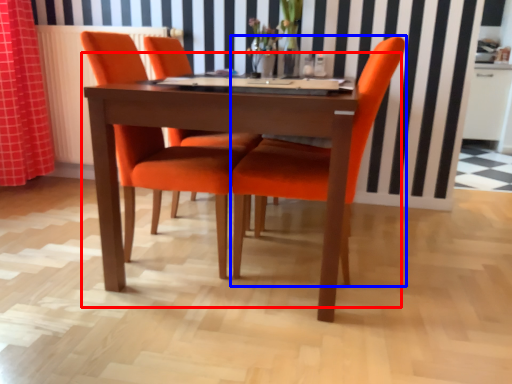
Question: Which point is further to the camera, kitchen & dining room table (highlighted by a red box) or chair (highlighted by a blue box)?

Choices:
 (A) kitchen & dining room table
 (B) chair

Answer: (B)